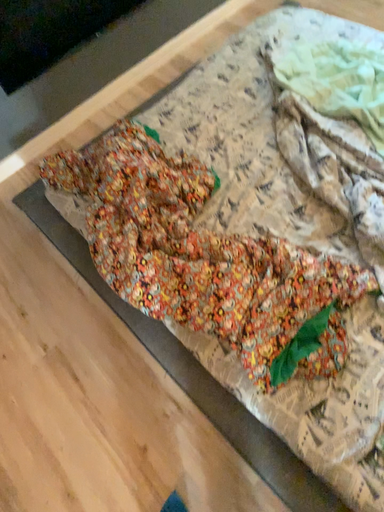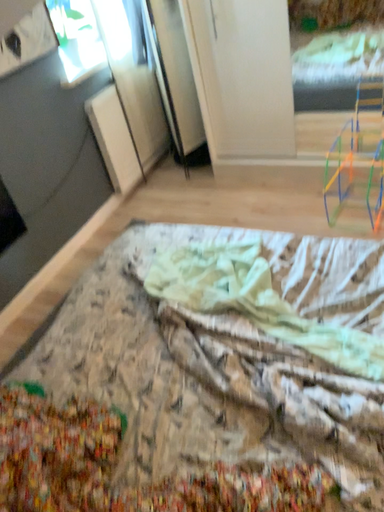
Question: How did the camera likely rotate when shooting the video?

Choices:
 (A) rotated right
 (B) rotated left

Answer: (A)